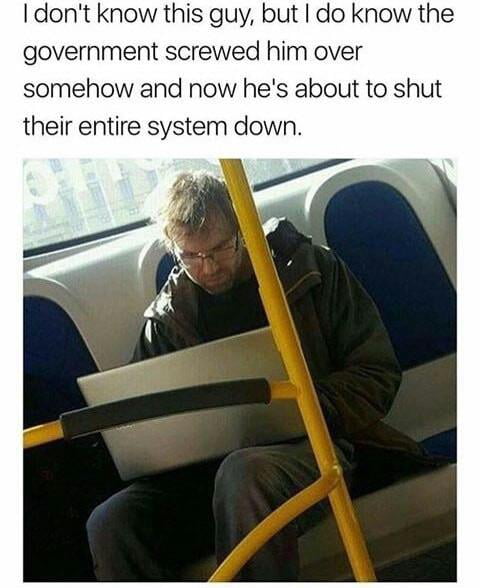
I want to click on window, so click(x=59, y=191).